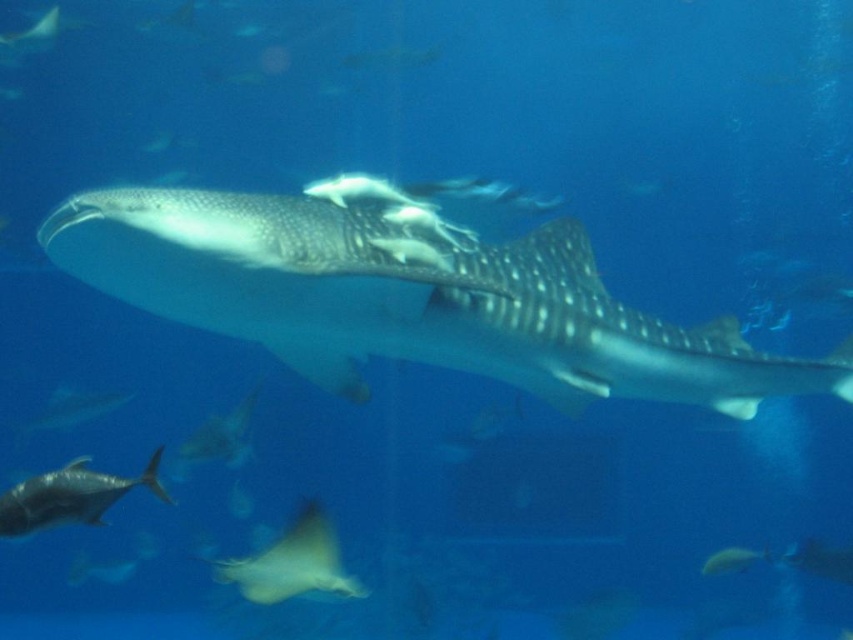
Looking at this image, you are a marine biologist observing the underwater scene. You notice the smooth gray shark at center and the shiny silver fish at center. Which one do you think is bigger?

The smooth gray shark at center is larger in size than the shiny silver fish at center, so the smooth gray shark at center is bigger.

You are a scuba diver with a camera. You want to take a photo of the smooth gray shark at center and the translucent yellow ray at lower center. Can you fit both in the frame if your camera has a 60cm width field of view?

The smooth gray shark at center might be wider than the translucent yellow ray at lower center, but without exact measurements, it is uncertain if both will fit in the 60cm width field of view. Check their combined width.

You are a marine biologist observing the underwater scene. You notice the smooth gray shark at center and the translucent yellow ray at lower center. Which of these two marine animals is taller in this image?

The smooth gray shark at center is much taller than the translucent yellow ray at lower center.